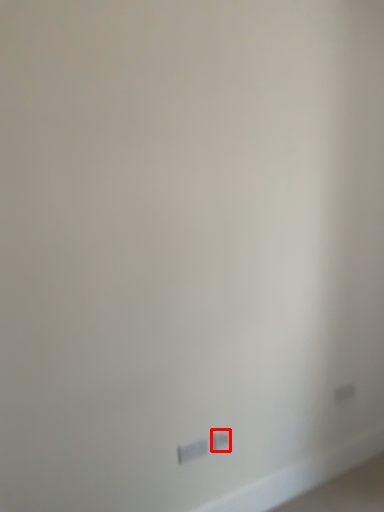
Question: Considering the relative positions of power plugs and sockets (annotated by the red box) and power plugs and sockets in the image provided, where is power plugs and sockets (annotated by the red box) located with respect to the staircase?

Choices:
 (A) left
 (B) right

Answer: (B)